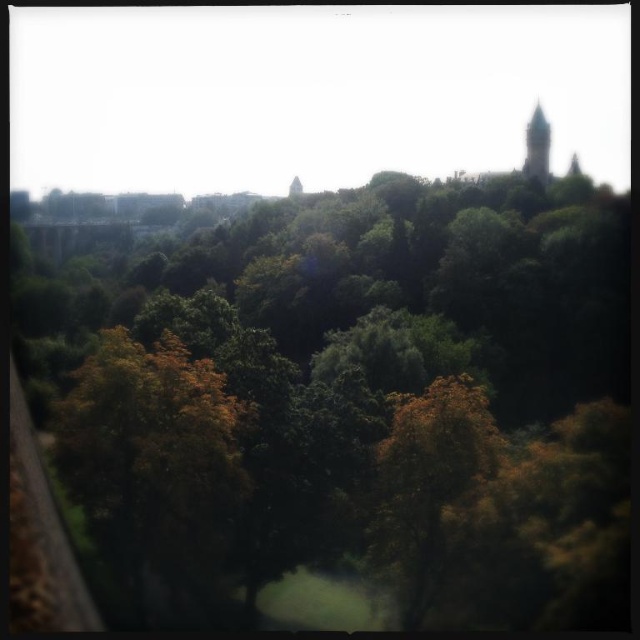
Question: Which of the following is the farthest from the observer?

Choices:
 (A) (531, 136)
 (B) (296, 419)

Answer: (A)

Question: Observing the image, what is the correct spatial positioning of green leafy tree at center in reference to greenish-blue stone spire at upper right?

Choices:
 (A) below
 (B) above

Answer: (A)

Question: Does green leafy tree at center have a lesser width compared to greenish-blue stone spire at upper right?

Choices:
 (A) yes
 (B) no

Answer: (B)

Question: Is green leafy tree at center thinner than greenish-blue stone spire at upper right?

Choices:
 (A) no
 (B) yes

Answer: (A)

Question: Which point is closer to the camera?

Choices:
 (A) greenish-blue stone spire at upper right
 (B) green leafy tree at center

Answer: (B)